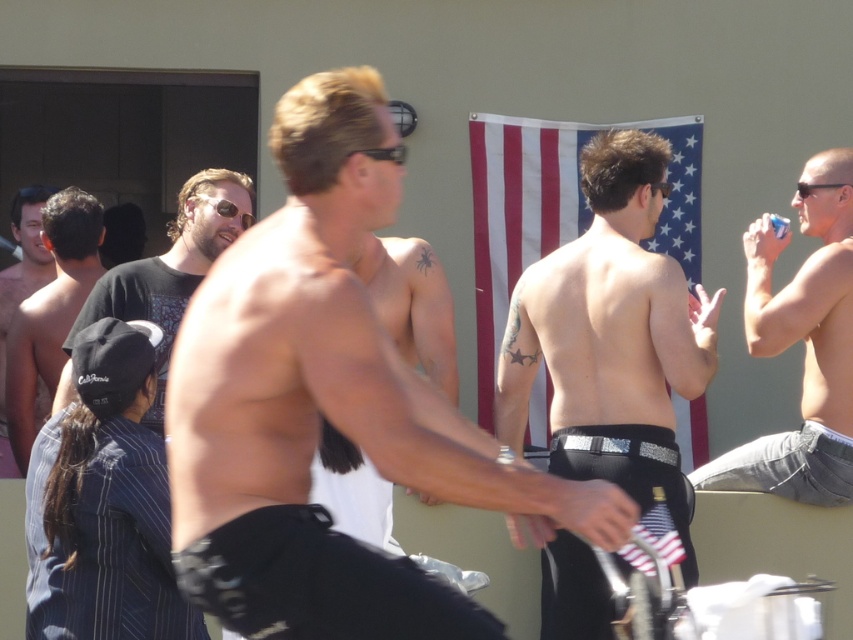
You are a guest at the poolside party and want to grab the clear plastic cup at upper right. However, there is a black plastic sunglasses at center in the way. Can you reach the cup without moving the sunglasses?

The black plastic sunglasses at center is closer to the viewer than the clear plastic cup at upper right, so you would need to move the sunglasses first to access the cup.